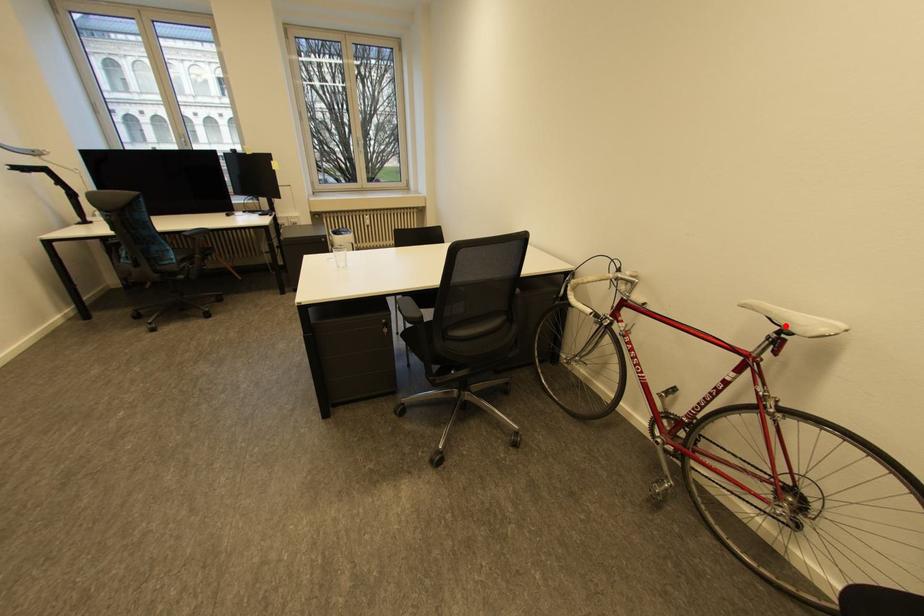
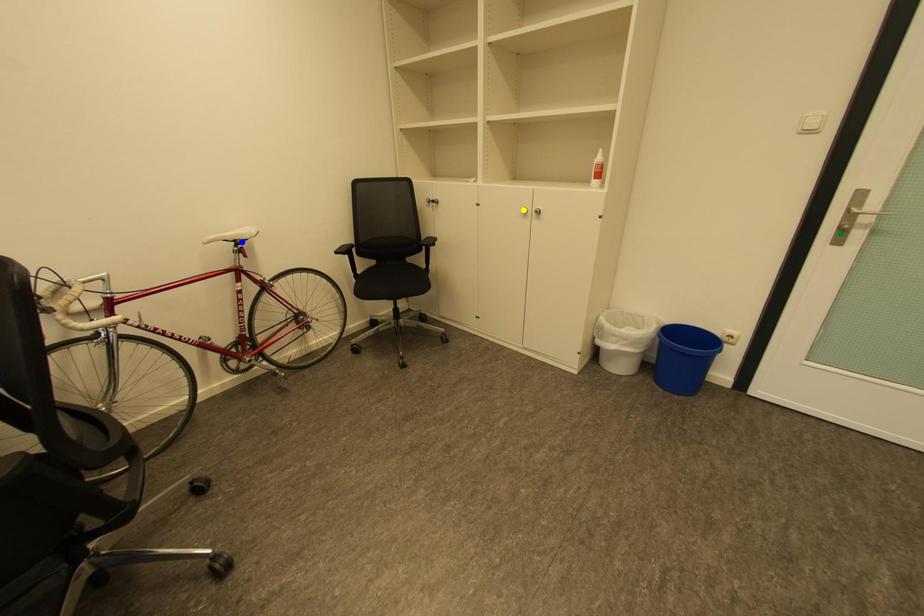
Question: I am providing you with two images of the same scene from different viewpoints. A red point is marked on the first image. You are given multiple points on the second image. Can you choose the point in image 2 that corresponds to the point in image 1?

Choices:
 (A) blue point
 (B) yellow point
 (C) green point

Answer: (A)